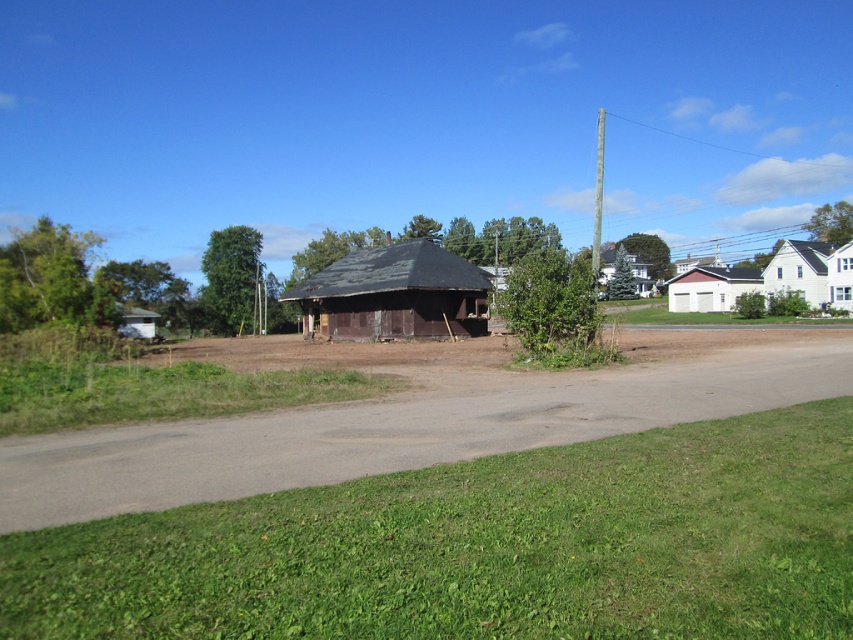
Who is more forward, [469,433] or [844,282]?

Positioned in front is point [469,433].

Who is shorter, brown dirt track at center or wooden hut at center?

With less height is brown dirt track at center.

Does point (397, 420) come in front of point (828, 300)?

That is True.

The width and height of the screenshot is (853, 640). In order to click on brown dirt track at center in this screenshot , I will do `click(413, 419)`.

Is white matte house at upper right smaller than wooden hut at center?

No, white matte house at upper right is not smaller than wooden hut at center.

Can you confirm if white matte house at upper right is positioned above wooden hut at center?

Yes, white matte house at upper right is above wooden hut at center.

At what (x,y) coordinates should I click in order to perform the action: click on white matte house at upper right. Please return your answer as a coordinate pair (x, y). The image size is (853, 640). Looking at the image, I should click on (798, 272).

Can you confirm if white matte house at upper right is taller than white matte garage at right?

Indeed, white matte house at upper right has a greater height compared to white matte garage at right.

Can you confirm if white matte house at upper right is bigger than white matte garage at right?

Yes.

Find the location of a particular element. white matte house at upper right is located at coordinates (798, 272).

The height and width of the screenshot is (640, 853). Find the location of `white matte house at upper right`. white matte house at upper right is located at coordinates (798, 272).